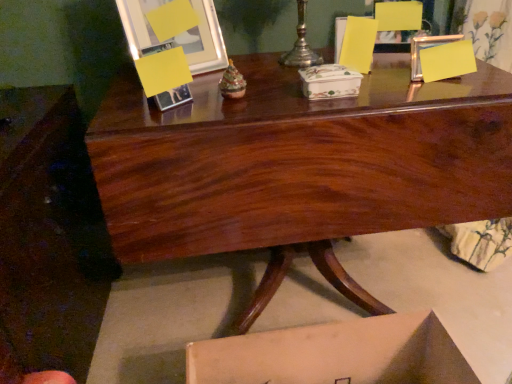
You are a GUI agent. You are given a task and a screenshot of the screen. Output one action in this format:
    pyautogui.click(x=<x>, y=<y>)
    Task: Click on the vacant region to the left of porcelain floral box at center
    
    Given the screenshot: What is the action you would take?
    pyautogui.click(x=257, y=99)